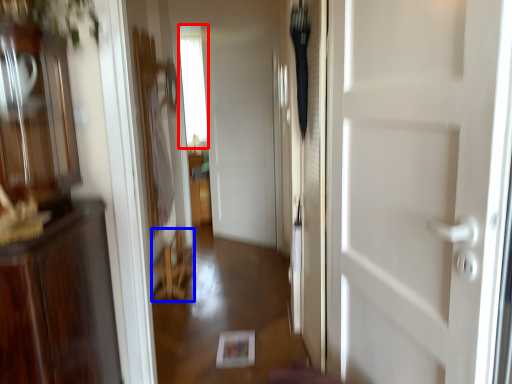
Question: Which object appears closest to the camera in this image, window (highlighted by a red box) or furniture (highlighted by a blue box)?

Choices:
 (A) window
 (B) furniture

Answer: (B)